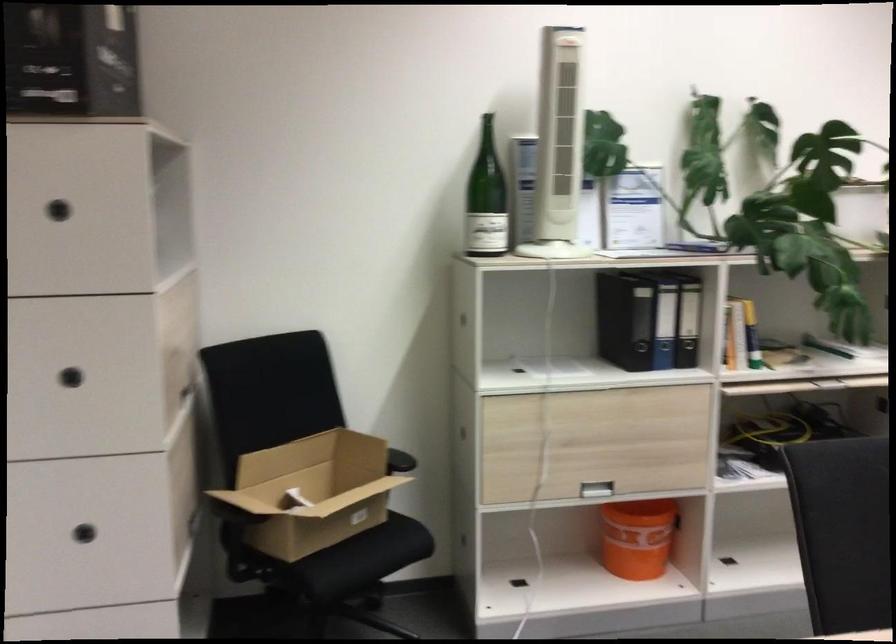
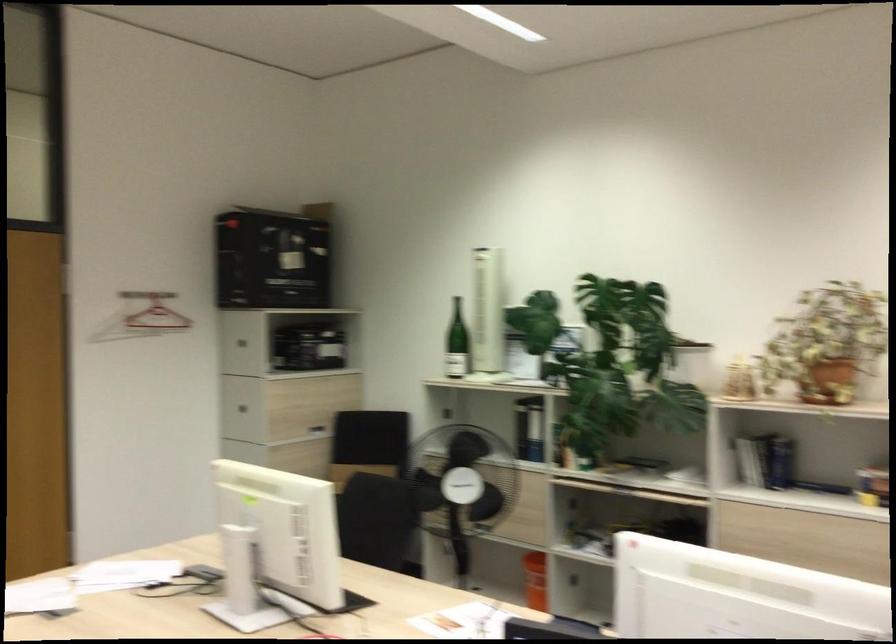
Where in the second image is the point corresponding to (87,219) from the first image?

(237, 341)